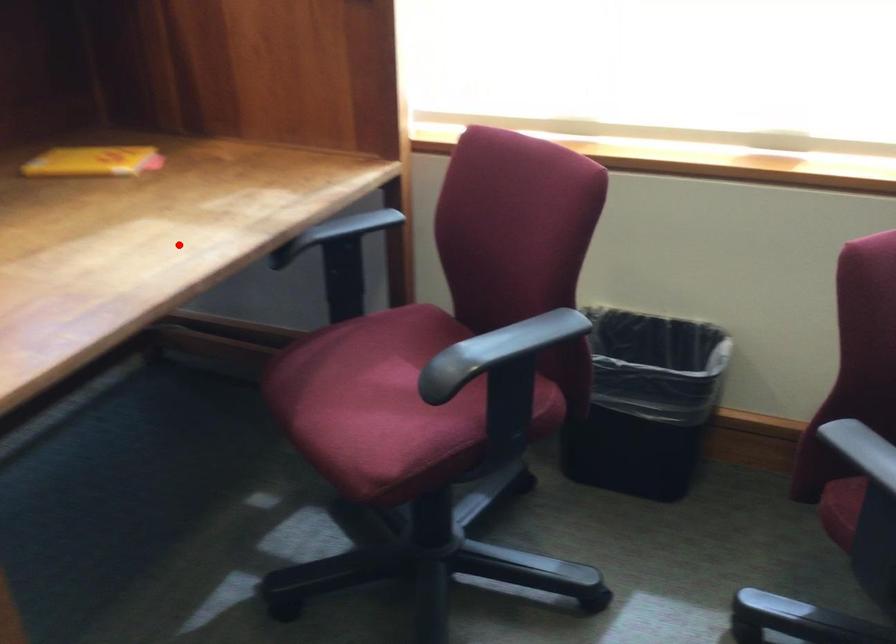
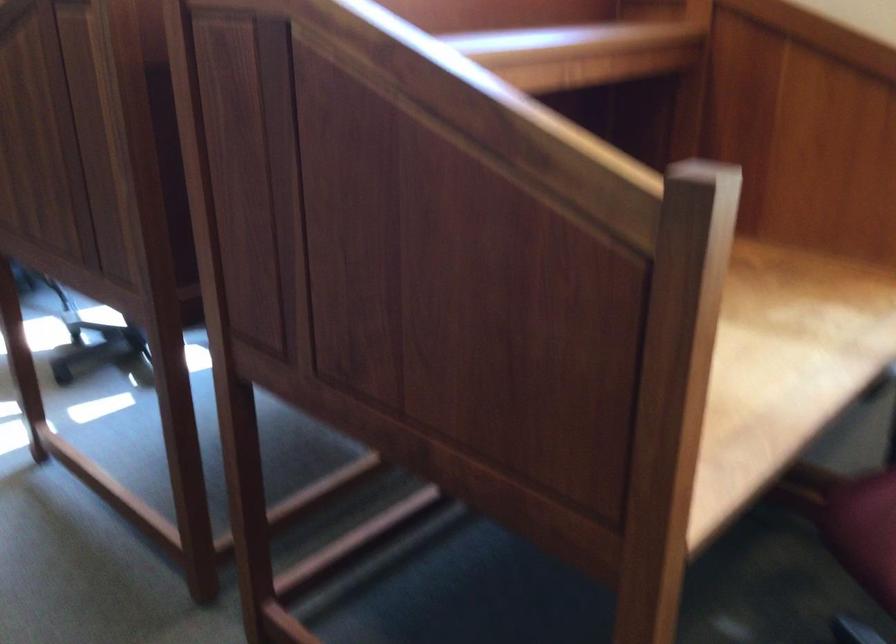
The point at the highlighted location is marked in the first image. Where is the corresponding point in the second image?

(778, 360)